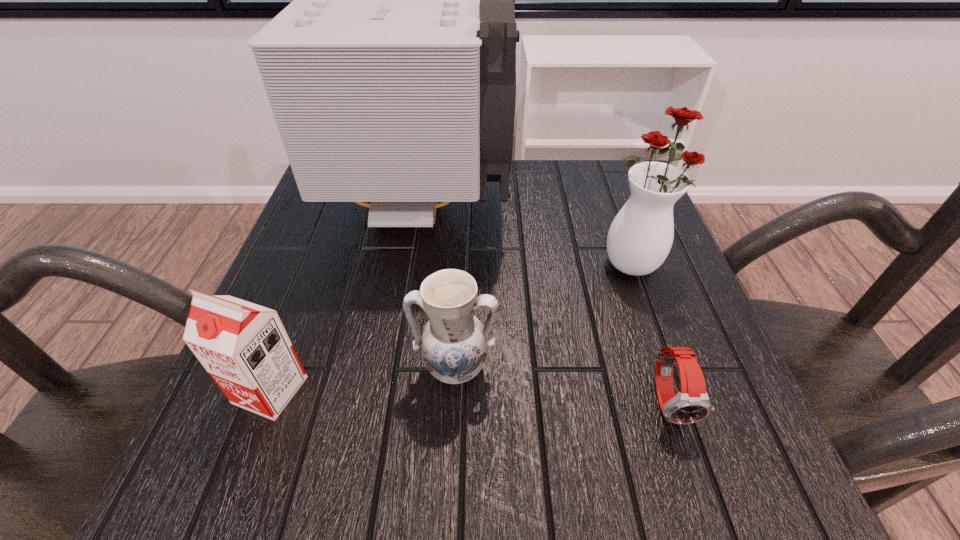
Locate an element on the screen. The width and height of the screenshot is (960, 540). fan that is positioned at the left edge is located at coordinates (392, 75).

The height and width of the screenshot is (540, 960). I want to click on soya milk present at the left edge, so click(244, 347).

Identify the location of vase positioned at the right edge. This screenshot has width=960, height=540. (640, 237).

Where is `watch that is at the right edge`? This screenshot has width=960, height=540. watch that is at the right edge is located at coordinates pyautogui.click(x=692, y=404).

Where is `object situated at the far left corner`? The height and width of the screenshot is (540, 960). object situated at the far left corner is located at coordinates (392, 75).

In the image, there is a desktop. At what (x,y) coordinates should I click in order to perform the action: click on vacant space at the far edge. Please return your answer as a coordinate pair (x, y). Looking at the image, I should click on (576, 199).

Locate an element on the screen. free space at the near edge is located at coordinates (606, 497).

At what (x,y) coordinates should I click in order to perform the action: click on free space at the left edge. Please return your answer as a coordinate pair (x, y). The height and width of the screenshot is (540, 960). Looking at the image, I should click on (355, 237).

In the image, there is a desktop. Where is `free space at the right edge`? free space at the right edge is located at coordinates (x=704, y=433).

The height and width of the screenshot is (540, 960). In the image, there is a desktop. In order to click on blank space at the near left corner in this screenshot , I will do `click(277, 476)`.